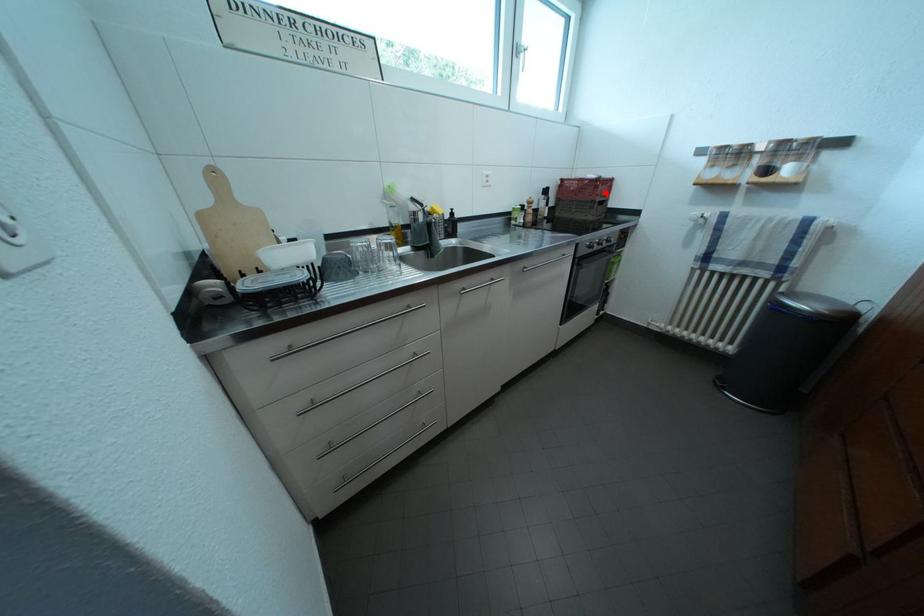
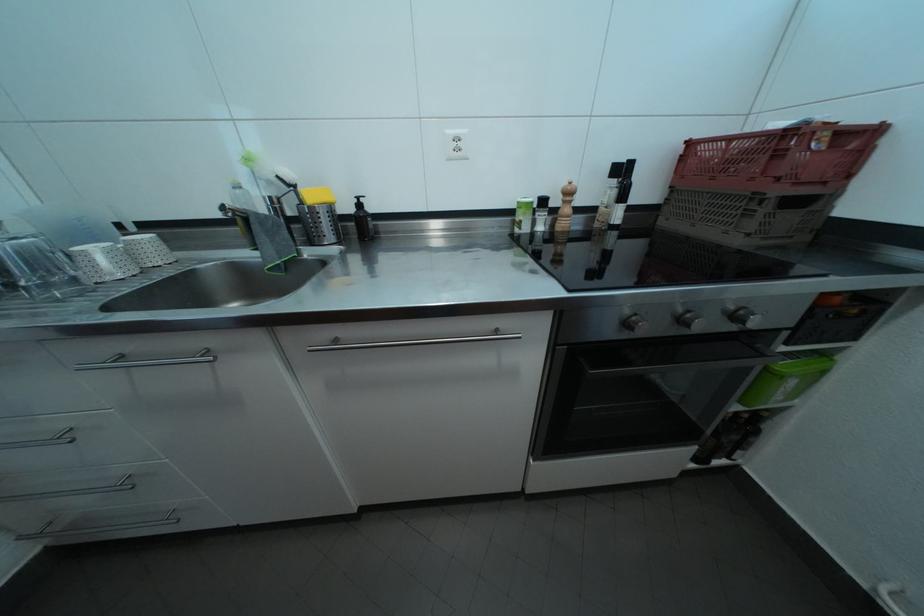
Question: I am providing you with two images of the same scene from different viewpoints. Image1 has a red point marked. In image2, the corresponding 3D location appears at what relative position? Reply with the corresponding letter.

Choices:
 (A) Closer
 (B) Farther

Answer: (B)